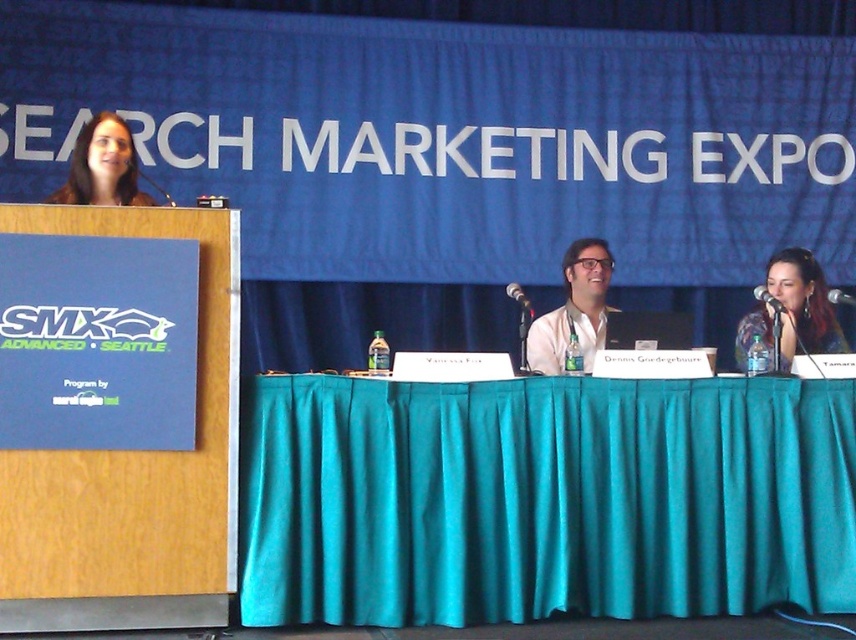
In the scene shown: Does blonde hair at upper left have a lesser height compared to metallic silver microphone at center?

In fact, blonde hair at upper left may be taller than metallic silver microphone at center.

Measure the distance between point (79,172) and camera.

Point (79,172) and camera are 5.14 meters apart from each other.

Is point (123, 124) positioned behind point (834, 300)?

No.

The height and width of the screenshot is (640, 856). I want to click on blonde hair at upper left, so pos(102,164).

Is point (758, 300) in front of point (831, 298)?

No, (758, 300) is behind (831, 298).

Which is more to the right, black plastic microphone at right or metallic silver microphone at center?

From the viewer's perspective, metallic silver microphone at center appears more on the right side.

Identify the location of black plastic microphone at right. The height and width of the screenshot is (640, 856). (768, 298).

Does teal fabric table at center have a greater height compared to matte black microphone at right?

Yes, teal fabric table at center is taller than matte black microphone at right.

Is point (798, 522) more distant than point (746, 342)?

No, (798, 522) is in front of (746, 342).

Locate an element on the screen. This screenshot has height=640, width=856. teal fabric table at center is located at coordinates (542, 499).